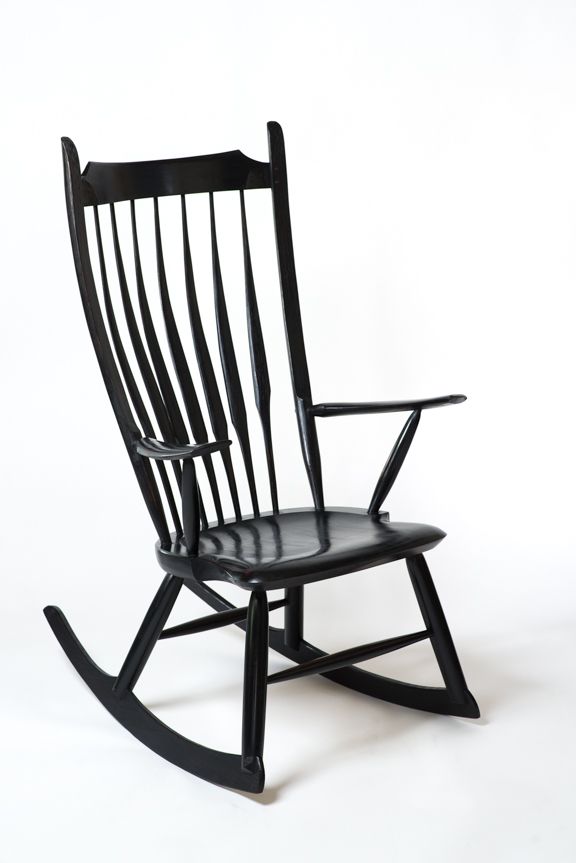
Locate an element on the screen. The image size is (576, 863). curved part of chair legs is located at coordinates (161, 740), (386, 683).